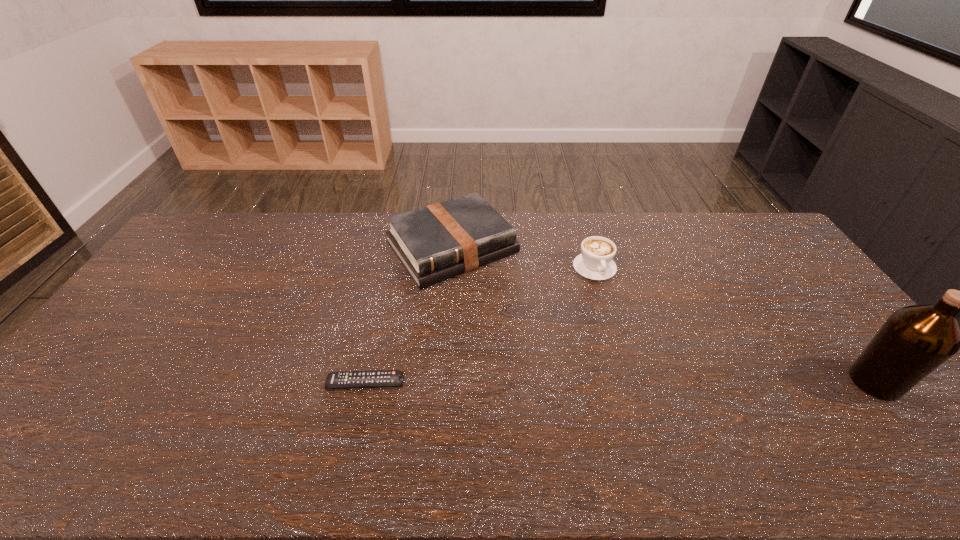
The image size is (960, 540). I want to click on blank space located 0.220m on the spine side of the hardback book, so click(523, 329).

Where is `vacant space located 0.210m on the spine side of the hardback book`? This screenshot has width=960, height=540. vacant space located 0.210m on the spine side of the hardback book is located at coordinates (521, 327).

The image size is (960, 540). I want to click on object that is at the far edge, so [x=439, y=241].

Image resolution: width=960 pixels, height=540 pixels. What are the coordinates of `object present at the near edge` in the screenshot? It's located at (915, 340).

At what (x,y) coordinates should I click in order to perform the action: click on object present at the right edge. Please return your answer as a coordinate pair (x, y). Image resolution: width=960 pixels, height=540 pixels. Looking at the image, I should click on (915, 340).

I want to click on object located in the near right corner section of the desktop, so click(915, 340).

In the image, there is a desktop. Where is `vacant space at the far edge`? This screenshot has height=540, width=960. vacant space at the far edge is located at coordinates (694, 228).

Locate an element on the screen. free space at the near edge of the desktop is located at coordinates (278, 414).

Where is `vacant area at the left edge`? This screenshot has width=960, height=540. vacant area at the left edge is located at coordinates (66, 386).

In order to click on vacant area at the right edge of the desktop in this screenshot , I will do `click(798, 274)`.